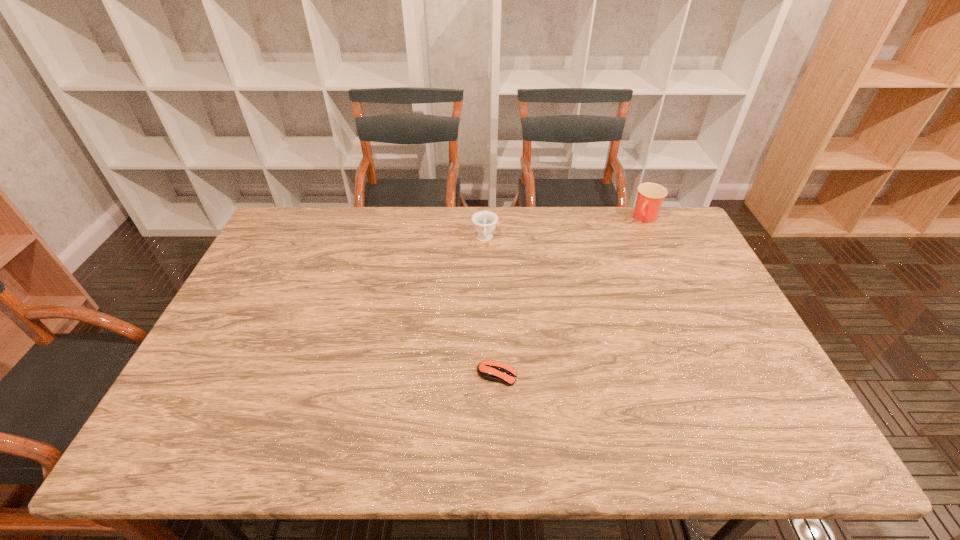
Where is `vacant space in between the shortest object and the cup`? The height and width of the screenshot is (540, 960). vacant space in between the shortest object and the cup is located at coordinates (571, 296).

Find the location of `empty space that is in between the second tallest object and the computer mouse`. empty space that is in between the second tallest object and the computer mouse is located at coordinates pos(491,307).

I want to click on vacant area between the farthest object and the teacup, so click(565, 229).

Find the location of `vacant point located between the nearest object and the rightmost object`. vacant point located between the nearest object and the rightmost object is located at coordinates (571, 296).

The image size is (960, 540). I want to click on free space between the tallest object and the nearest object, so click(x=571, y=296).

This screenshot has height=540, width=960. I want to click on free space between the tallest object and the second farthest object, so click(x=565, y=229).

Where is `vacant space that is in between the nearest object and the second farthest object`? vacant space that is in between the nearest object and the second farthest object is located at coordinates (491, 307).

This screenshot has width=960, height=540. Identify the location of free area in between the computer mouse and the farthest object. (571, 296).

The height and width of the screenshot is (540, 960). In order to click on the second closest object to the nearest object in this screenshot , I will do `click(650, 196)`.

Find the location of a particular element. the closest object to the nearest object is located at coordinates (484, 222).